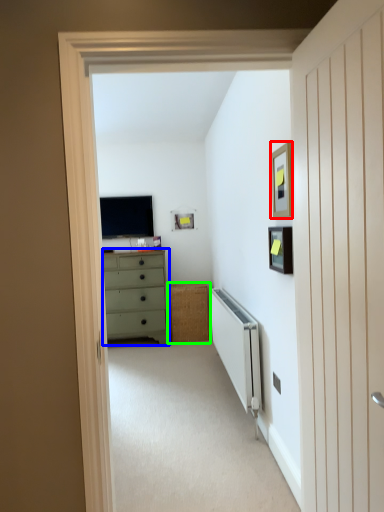
Question: Which object is the closest to the picture frame (highlighted by a red box)? Choose among these: chest of drawers (highlighted by a blue box) or cabinetry (highlighted by a green box).

Choices:
 (A) chest of drawers
 (B) cabinetry

Answer: (A)